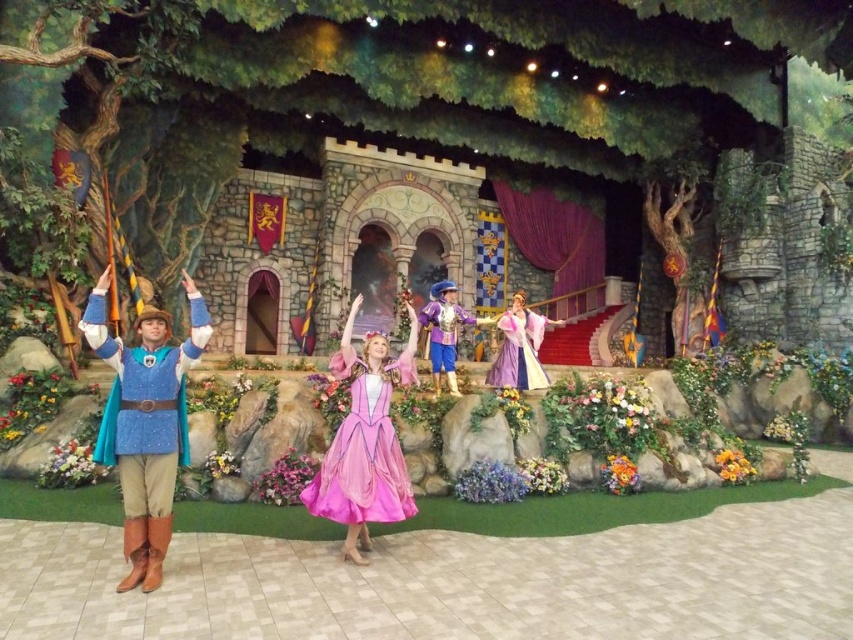
The image size is (853, 640). I want to click on pink satin dress at center, so click(364, 442).

Who is shorter, pink satin dress at center or shiny gold dress at center?

shiny gold dress at center

Is point (347, 442) less distant than point (438, 282)?

Yes, point (347, 442) is in front of point (438, 282).

Where is `pink satin dress at center`? Image resolution: width=853 pixels, height=640 pixels. pink satin dress at center is located at coordinates (364, 442).

Who is taller, blue fabric cape at left or pastel purple satin dress at center?

blue fabric cape at left is taller.

Can you confirm if blue fabric cape at left is bigger than pastel purple satin dress at center?

Correct, blue fabric cape at left is larger in size than pastel purple satin dress at center.

Is point (166, 371) positioned in front of point (537, 332)?

Yes, point (166, 371) is closer to viewer.

This screenshot has height=640, width=853. I want to click on blue fabric cape at left, so click(144, 422).

The image size is (853, 640). What do you see at coordinates (364, 442) in the screenshot? I see `pink satin dress at center` at bounding box center [364, 442].

Can you confirm if pink satin dress at center is wider than pastel purple satin dress at center?

No.

Where is `pink satin dress at center`? Image resolution: width=853 pixels, height=640 pixels. pink satin dress at center is located at coordinates (364, 442).

The image size is (853, 640). I want to click on pink satin dress at center, so click(x=364, y=442).